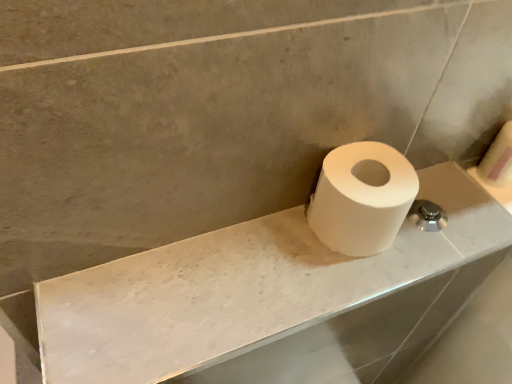
Question: From the image's perspective, is white marble counter top at center over white matte toilet paper at right, the second toilet paper positioned from the left?

Choices:
 (A) yes
 (B) no

Answer: (B)

Question: Is white marble counter top at center oriented away from white matte toilet paper at right, the second toilet paper from the front?

Choices:
 (A) yes
 (B) no

Answer: (B)

Question: Can you confirm if white marble counter top at center is wider than white matte toilet paper at right, the second toilet paper positioned from the left?

Choices:
 (A) no
 (B) yes

Answer: (B)

Question: Is white marble counter top at center aimed at white matte toilet paper at right, the second toilet paper positioned from the left?

Choices:
 (A) yes
 (B) no

Answer: (B)

Question: Is white marble counter top at center at the left side of white matte toilet paper at right, the first toilet paper from the right?

Choices:
 (A) yes
 (B) no

Answer: (A)

Question: From a real-world perspective, is white marble counter top at center above or below white matte toilet paper at right, the second toilet paper positioned from the left?

Choices:
 (A) above
 (B) below

Answer: (B)

Question: Based on their sizes in the image, would you say white marble counter top at center is bigger or smaller than white matte toilet paper at right, the first toilet paper from the right?

Choices:
 (A) small
 (B) big

Answer: (B)

Question: Is white marble counter top at center wider or thinner than white matte toilet paper at right, the second toilet paper positioned from the left?

Choices:
 (A) wide
 (B) thin

Answer: (A)

Question: From the image's perspective, is white marble counter top at center positioned above or below white matte toilet paper at right, the second toilet paper from the front?

Choices:
 (A) above
 (B) below

Answer: (B)

Question: From the image's perspective, is white matte toilet paper at right, which ranks as the first toilet paper in left-to-right order, positioned above or below white marble counter top at center?

Choices:
 (A) below
 (B) above

Answer: (B)

Question: In terms of height, does white matte toilet paper at right, which ranks as the first toilet paper in left-to-right order, look taller or shorter compared to white marble counter top at center?

Choices:
 (A) short
 (B) tall

Answer: (B)

Question: Visually, is white matte toilet paper at right, which ranks as the first toilet paper in left-to-right order, positioned to the left or to the right of white marble counter top at center?

Choices:
 (A) right
 (B) left

Answer: (A)

Question: Is point (329, 221) positioned closer to the camera than point (265, 236)?

Choices:
 (A) closer
 (B) farther

Answer: (A)

Question: Is point (499, 155) closer or farther from the camera than point (397, 165)?

Choices:
 (A) closer
 (B) farther

Answer: (B)

Question: In terms of size, does white matte toilet paper at right, the second toilet paper positioned from the left, appear bigger or smaller than white matte toilet paper at right, positioned as the 2th toilet paper in back-to-front order?

Choices:
 (A) big
 (B) small

Answer: (B)